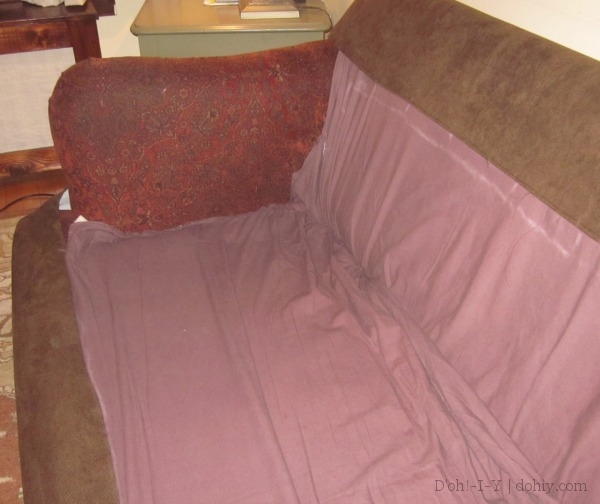
Locate an element on the screen. The height and width of the screenshot is (504, 600). cable / cord is located at coordinates (40, 195).